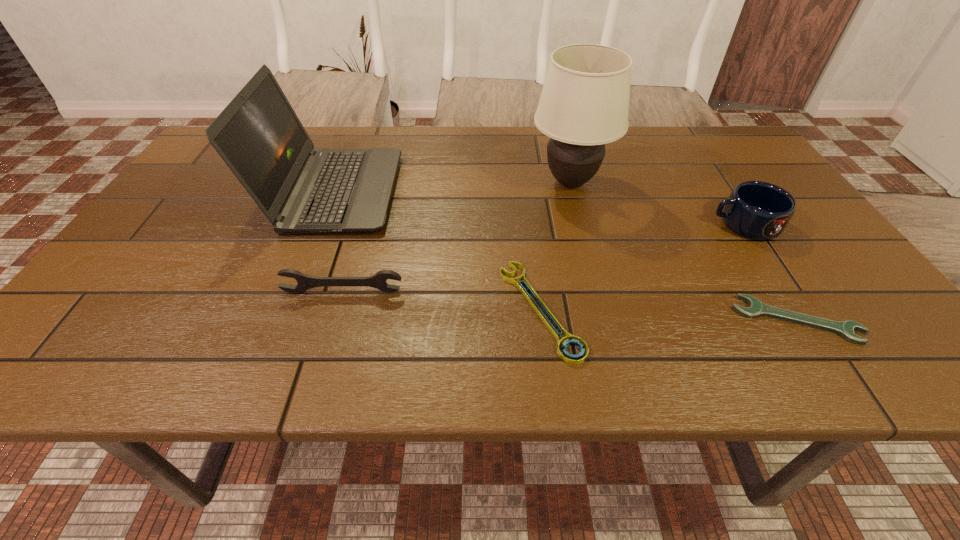
Find the location of `free spot at the far edge of the desktop`. free spot at the far edge of the desktop is located at coordinates (631, 145).

Locate an element on the screen. Image resolution: width=960 pixels, height=540 pixels. free region at the near edge is located at coordinates (531, 343).

Where is `vacant area at the left edge`? vacant area at the left edge is located at coordinates (226, 169).

This screenshot has width=960, height=540. I want to click on blank space at the right edge, so click(786, 227).

At what (x,y) coordinates should I click in order to perform the action: click on vacant region at the near left corner of the desktop. Please return your answer as a coordinate pair (x, y). Looking at the image, I should click on (79, 375).

The image size is (960, 540). I want to click on vacant space at the near right corner, so click(x=913, y=359).

The width and height of the screenshot is (960, 540). Identify the location of vacant area that lies between the mug and the laptop_computer. (540, 208).

You are a GUI agent. You are given a task and a screenshot of the screen. Output one action in this format:
    pyautogui.click(x=<x>, y=<y>)
    Task: Click on the unoccupied position between the lampshade and the laptop_computer
    The height and width of the screenshot is (540, 960).
    Given the screenshot: What is the action you would take?
    (453, 187)

Find the location of `vacant point located between the lampshade and the second wrench from left to right`. vacant point located between the lampshade and the second wrench from left to right is located at coordinates (556, 246).

Identify the location of unoccupied position between the tallest object and the fourth tallest object. click(457, 237).